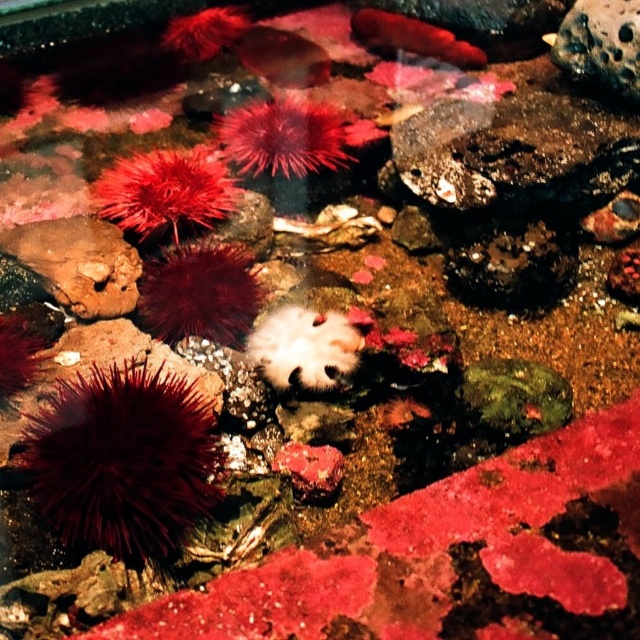
You are a marine biologist observing the underwater scene. You notice the red spiky sea urchin at center and the white fuzzy sea anemone at center. Which one is located higher in the water column?

The red spiky sea urchin at center is positioned over the white fuzzy sea anemone at center, so it is located higher in the water column.

You are a marine biologist observing the underwater scene. You notice the brown rough rock at left and the fuzzy red sea urchin at upper center. Which object is nearer to your viewpoint?

The brown rough rock at left is closer to the viewer than the fuzzy red sea urchin at upper center.

You are a marine biologist observing this underwater scene. You notice the dark red spiky sea urchin at lower left and the brown rough rock at left. Which object is bigger in size?

The dark red spiky sea urchin at lower left has a larger size compared to the brown rough rock at left, so the dark red spiky sea urchin at lower left is bigger.